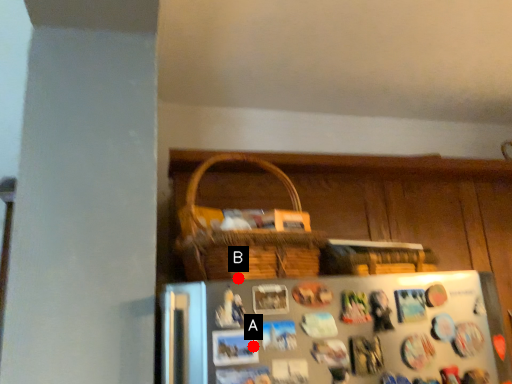
Question: Two points are circled on the image, labeled by A and B beside each circle. Among these points, which one is nearest to the camera?

Choices:
 (A) A is closer
 (B) B is closer

Answer: (A)